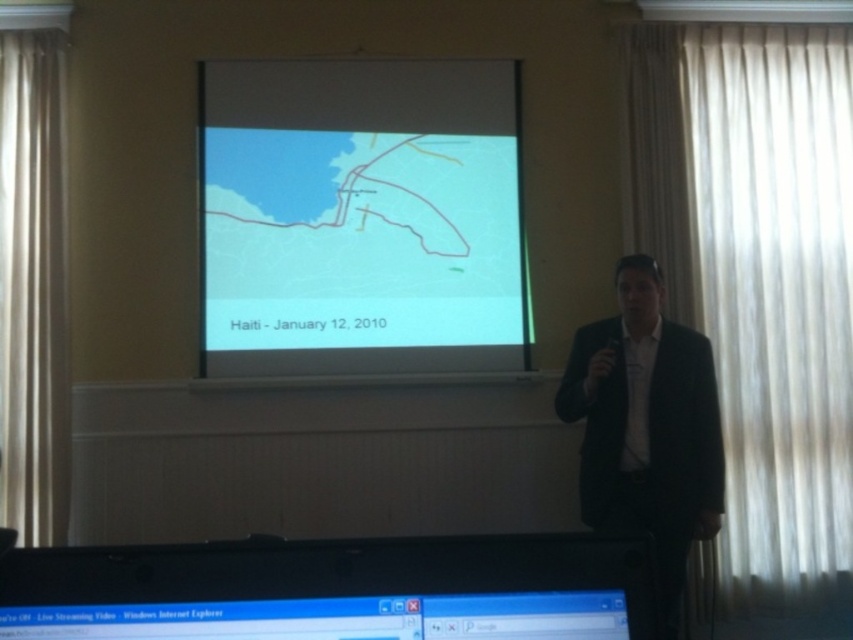
Question: Considering the relative positions of black plastic monitor at lower center and black suit at right in the image provided, where is black plastic monitor at lower center located with respect to black suit at right?

Choices:
 (A) above
 (B) below

Answer: (A)

Question: Considering the relative positions of matte map at center and black plastic monitor at lower center in the image provided, where is matte map at center located with respect to black plastic monitor at lower center?

Choices:
 (A) left
 (B) right

Answer: (A)

Question: Among these points, which one is farthest from the camera?

Choices:
 (A) (618, 269)
 (B) (621, 540)
 (C) (231, 269)

Answer: (C)

Question: Observing the image, what is the correct spatial positioning of matte map at center in reference to black suit at right?

Choices:
 (A) left
 (B) right

Answer: (A)

Question: Which point is farther to the camera?

Choices:
 (A) black suit at right
 (B) black plastic monitor at lower center

Answer: (A)

Question: Which point appears closest to the camera in this image?

Choices:
 (A) (15, 604)
 (B) (639, 285)

Answer: (A)